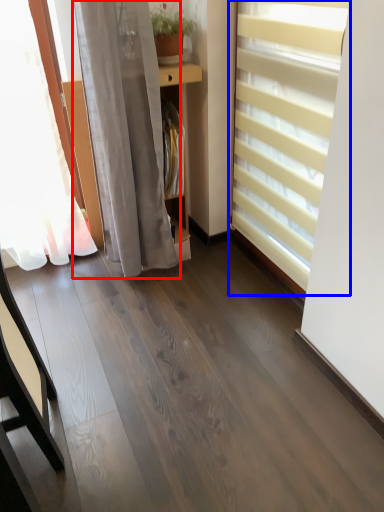
Question: Which object appears farthest to the camera in this image, curtain (highlighted by a red box) or window blind (highlighted by a blue box)?

Choices:
 (A) curtain
 (B) window blind

Answer: (A)